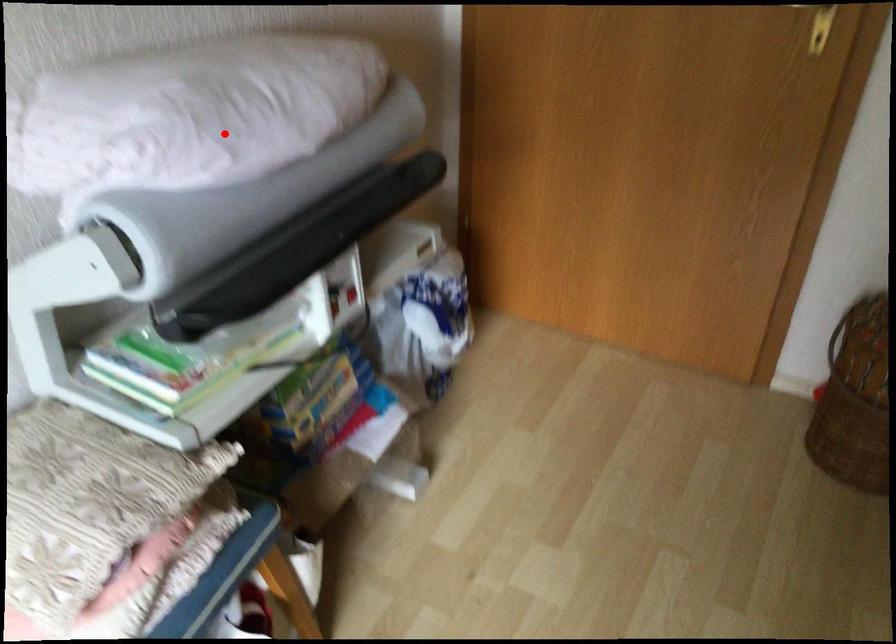
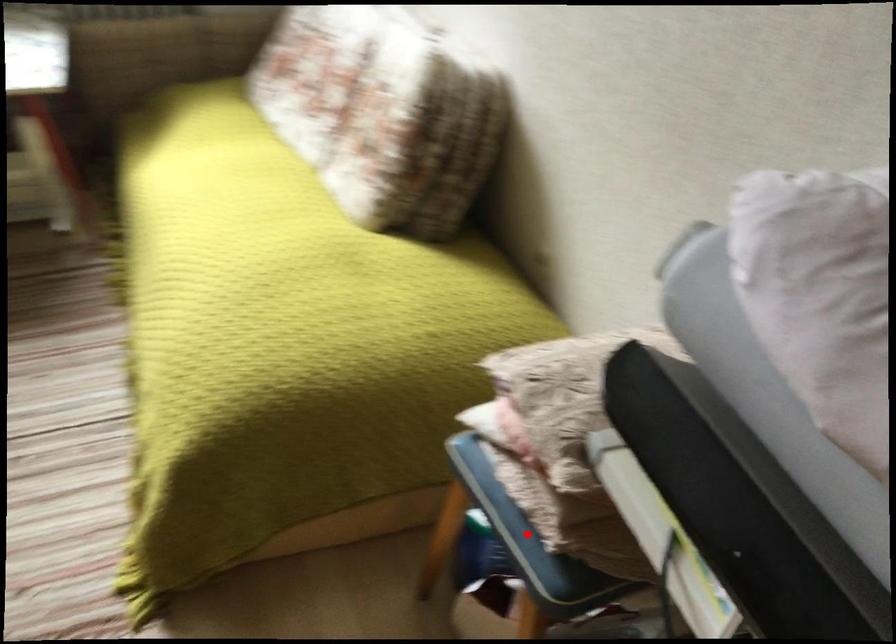
I am providing you with two images of the same scene from different viewpoints. A red point is marked on the first image and another point is marked on the second image. Are the points marked in image1 and image2 representing the same 3D position?

No